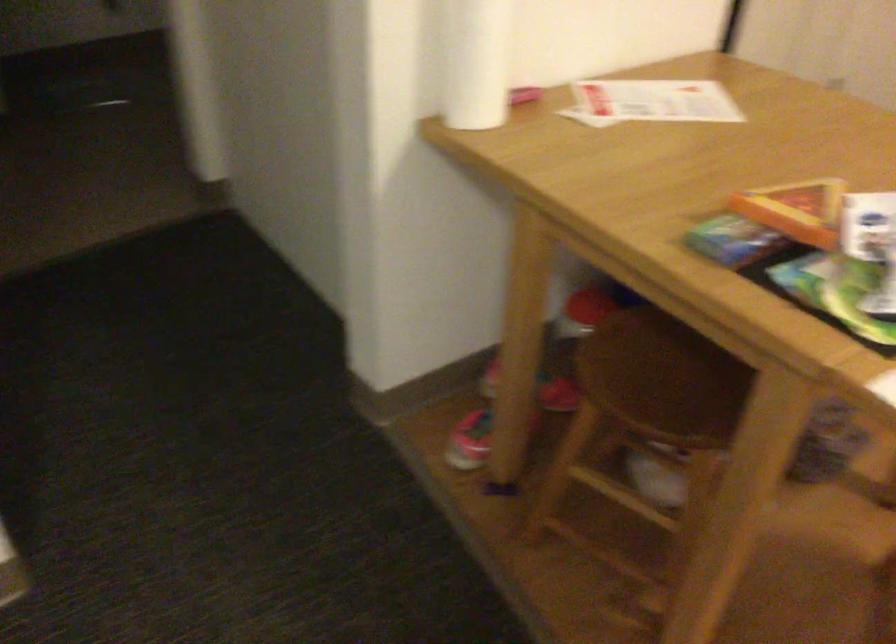
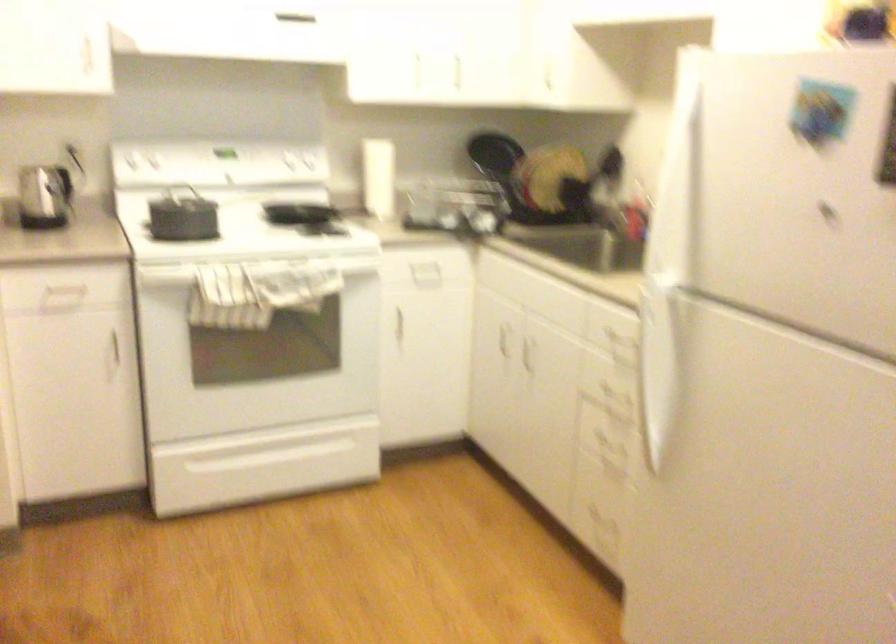
Question: Based on the continuous images, in which direction is the camera rotating? Reply with the corresponding letter.

Choices:
 (A) Left
 (B) Right
 (C) Up
 (D) Down

Answer: (B)